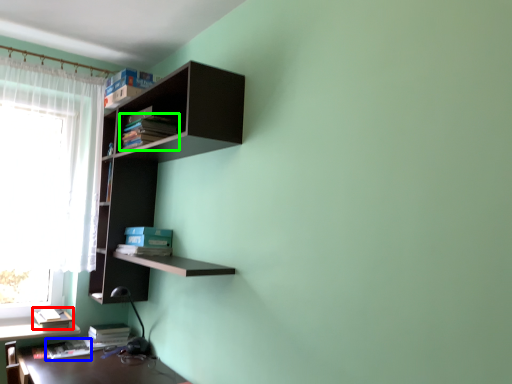
Question: Which object is positioned farthest from book (highlighted by a red box)? Select from book (highlighted by a blue box) and book (highlighted by a green box).

Choices:
 (A) book
 (B) book

Answer: (B)